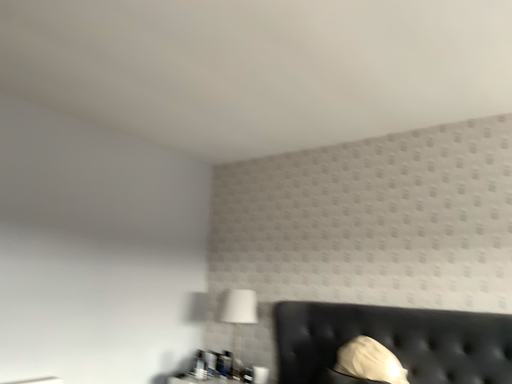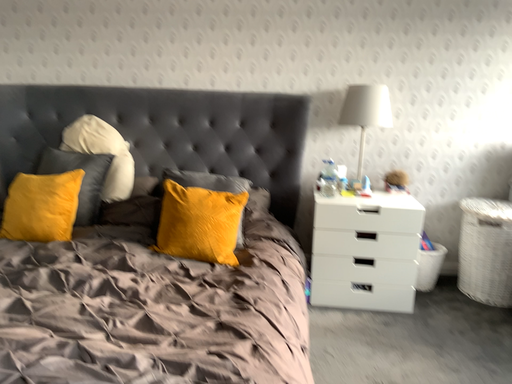
Question: How did the camera likely rotate when shooting the video?

Choices:
 (A) rotated left
 (B) rotated right

Answer: (B)